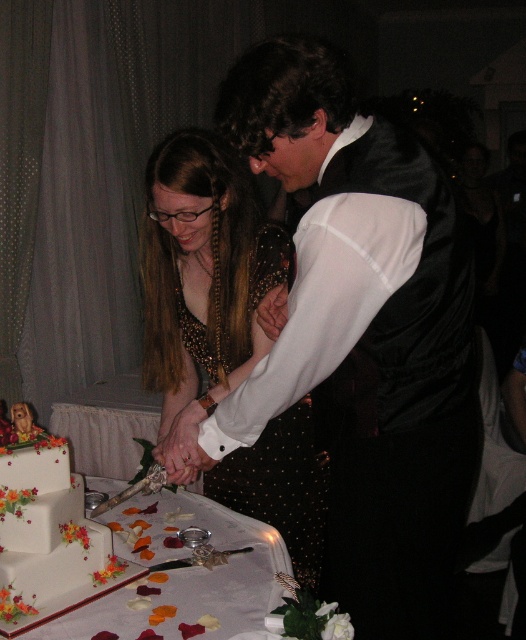
Question: Among these objects, which one is farthest from the camera?

Choices:
 (A) black sequined dress at center
 (B) matte black vest at center

Answer: (A)

Question: Considering the relative positions of matte black vest at center and black sequined dress at center in the image provided, where is matte black vest at center located with respect to black sequined dress at center?

Choices:
 (A) above
 (B) below

Answer: (A)

Question: Among these objects, which one is farthest from the camera?

Choices:
 (A) black sequined dress at center
 (B) matte black vest at center

Answer: (A)

Question: Is matte black vest at center smaller than black sequined dress at center?

Choices:
 (A) yes
 (B) no

Answer: (B)

Question: In this image, where is matte black vest at center located relative to white floral-decorated cake at lower left?

Choices:
 (A) below
 (B) above

Answer: (B)

Question: Which object is positioned closest to the matte black vest at center?

Choices:
 (A) black sequined dress at center
 (B) white floral-decorated cake at lower left

Answer: (A)